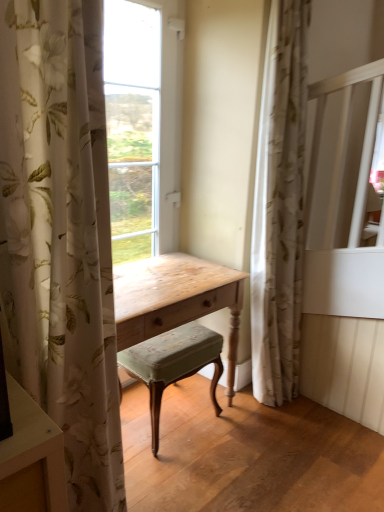
Question: Considering the positions of white floral fabric curtain at left, the second curtain when ordered from right to left, and velvet green cushioned stool at center in the image, is white floral fabric curtain at left, the second curtain when ordered from right to left, wider or thinner than velvet green cushioned stool at center?

Choices:
 (A) wide
 (B) thin

Answer: (B)

Question: Considering the relative positions of white floral fabric curtain at left, marked as the first curtain in a left-to-right arrangement, and velvet green cushioned stool at center in the image provided, is white floral fabric curtain at left, marked as the first curtain in a left-to-right arrangement, to the left or to the right of velvet green cushioned stool at center?

Choices:
 (A) left
 (B) right

Answer: (A)

Question: Considering the real-world distances, which object is closest to the floral sheer curtain at right, the second curtain viewed from the front?

Choices:
 (A) white floral fabric curtain at left, which appears as the 2th curtain when viewed from the back
 (B) velvet green cushioned stool at center

Answer: (B)

Question: Considering the real-world distances, which object is closest to the white floral fabric curtain at left, marked as the first curtain in a left-to-right arrangement?

Choices:
 (A) velvet green cushioned stool at center
 (B) floral sheer curtain at right, the second curtain viewed from the front

Answer: (A)